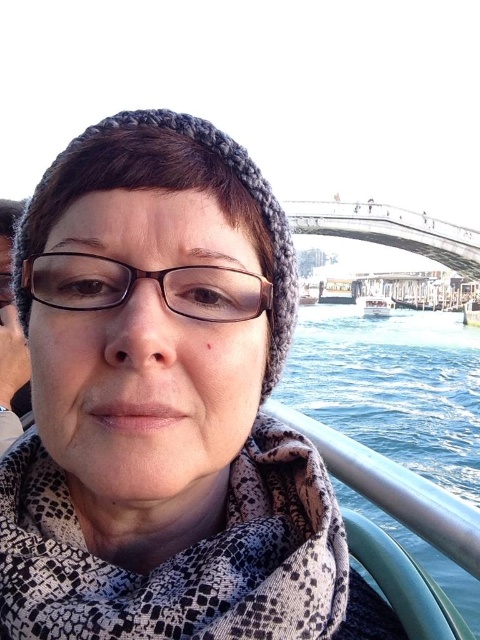
Question: Does brown matte glasses at center lie behind white plastic boat at center?

Choices:
 (A) yes
 (B) no

Answer: (B)

Question: Observing the image, what is the correct spatial positioning of concrete bridge at center in reference to metallic silver boat at center?

Choices:
 (A) above
 (B) below

Answer: (A)

Question: Which point is farther to the camera?

Choices:
 (A) (351, 209)
 (B) (365, 410)
 (C) (283, 627)
 (D) (249, 305)

Answer: (A)

Question: Among these points, which one is farthest from the camera?

Choices:
 (A) (330, 285)
 (B) (131, 292)
 (C) (157, 556)
 (D) (314, 227)

Answer: (A)

Question: Does knitted gray beanie at upper center appear on the left side of concrete bridge at center?

Choices:
 (A) yes
 (B) no

Answer: (A)

Question: Which object is farther from the camera taking this photo?

Choices:
 (A) concrete bridge at center
 (B) clear blue water at lower right
 (C) knitted gray beanie at upper center

Answer: (A)